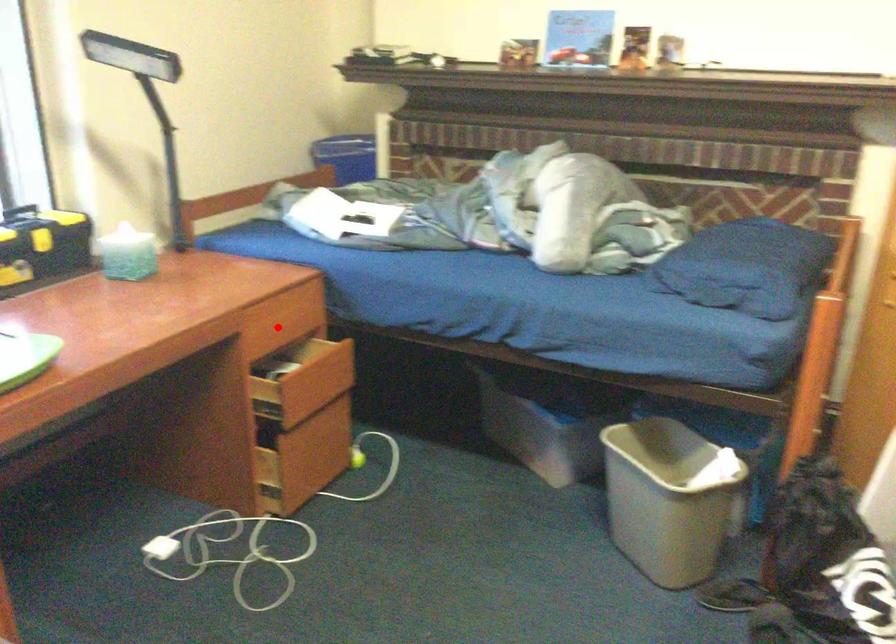
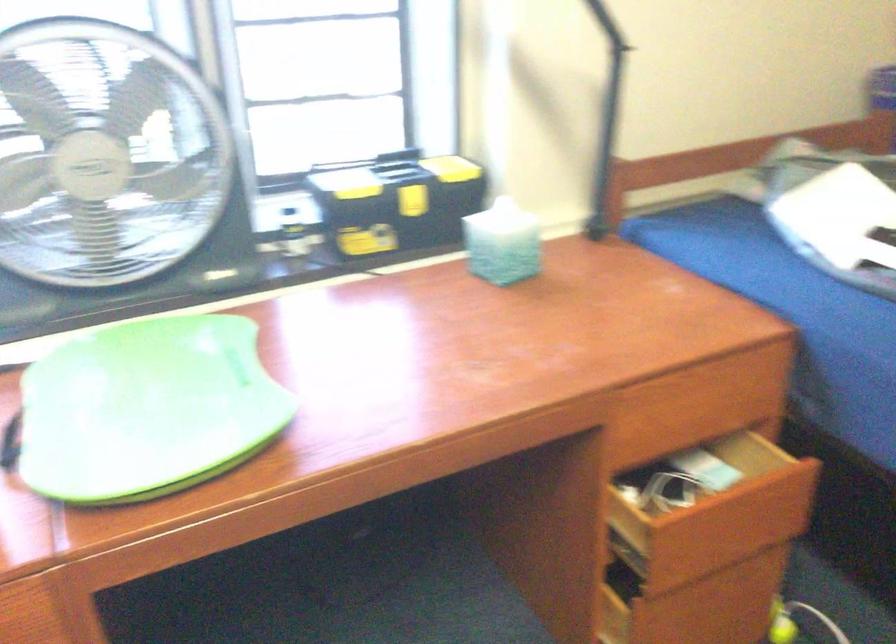
Question: I am providing you with two images of the same scene from different viewpoints. A red point is shown in image1. For the corresponding object point in image2, is it positioned nearer or farther from the camera?

Choices:
 (A) Nearer
 (B) Farther

Answer: (A)